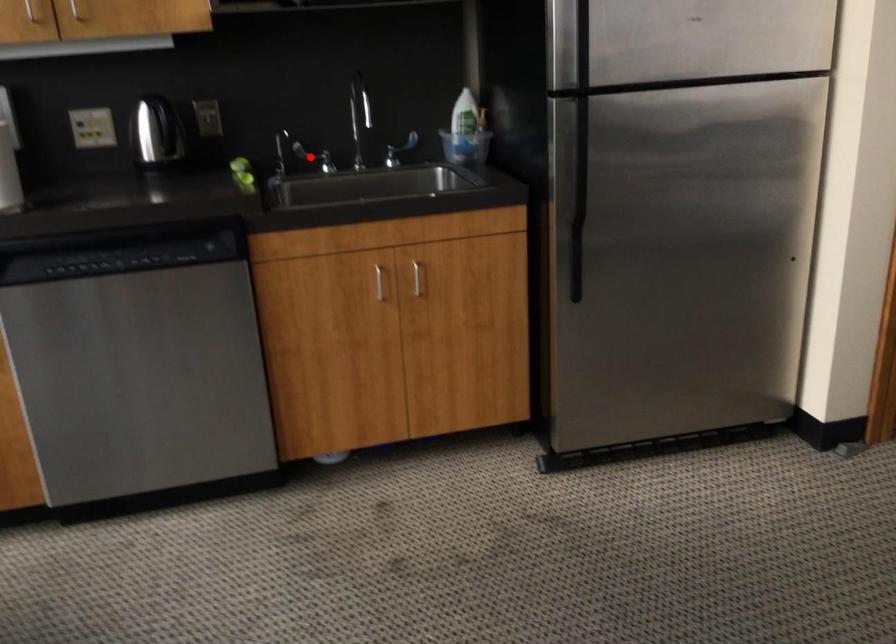
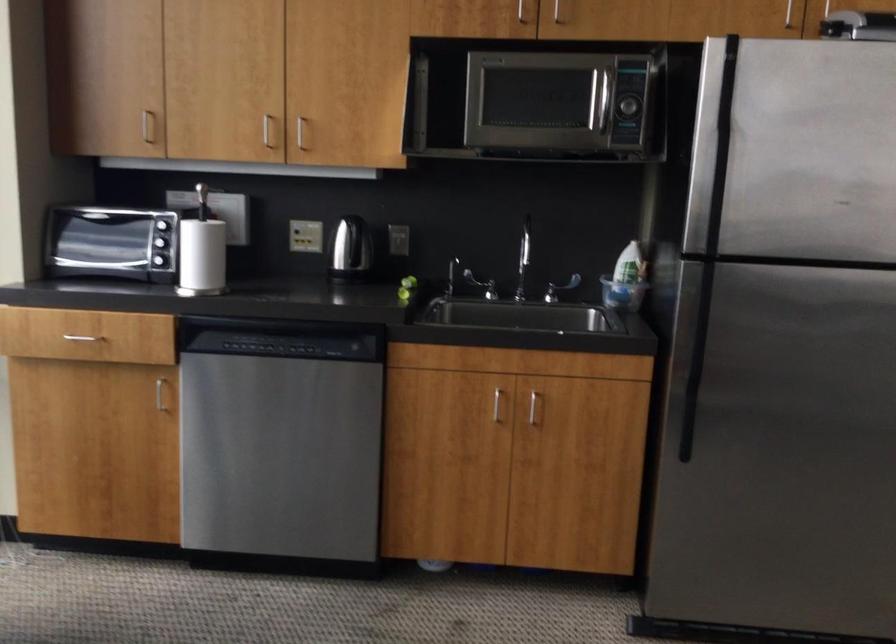
Where in the second image is the point corresponding to the highlighted location from the first image?

(480, 285)